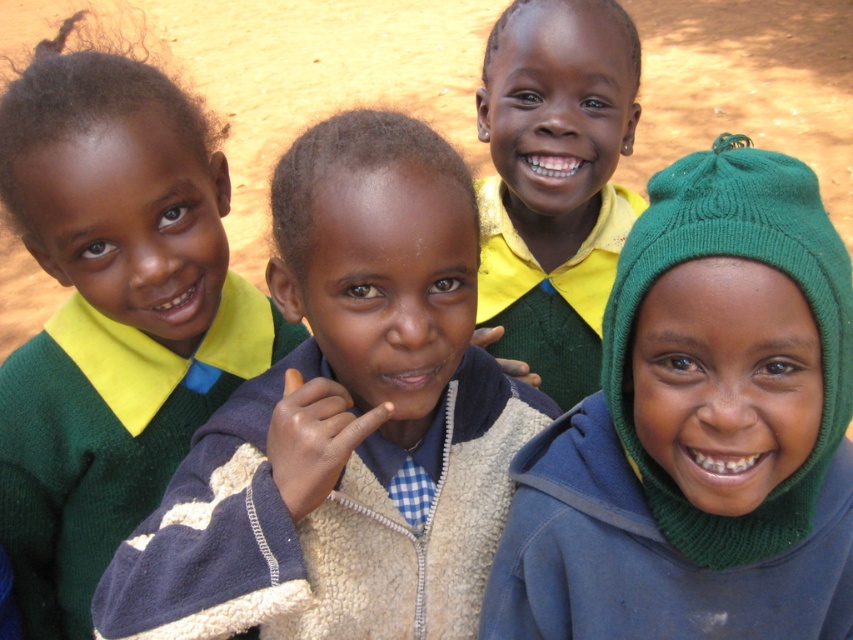
Does green knitted sweater at center appear over green knitted hat at upper right?

Yes, green knitted sweater at center is above green knitted hat at upper right.

Can you confirm if green knitted sweater at center is thinner than green knitted hat at upper right?

No, green knitted sweater at center is not thinner than green knitted hat at upper right.

Is point (386, 499) closer to viewer compared to point (804, 170)?

That is False.

Where is `green knitted sweater at center`? This screenshot has height=640, width=853. green knitted sweater at center is located at coordinates (345, 420).

Describe the element at coordinates (699, 428) in the screenshot. This screenshot has width=853, height=640. I see `green knitted hat at upper right` at that location.

Between green knitted hat at upper right and matte yellow shirt at center, which one appears on the left side from the viewer's perspective?

From the viewer's perspective, matte yellow shirt at center appears more on the left side.

Where is `green knitted hat at upper right`? green knitted hat at upper right is located at coordinates (699, 428).

I want to click on green knitted hat at upper right, so click(x=699, y=428).

Does green knitted sweater at center have a greater width compared to matte yellow shirt at center?

Indeed, green knitted sweater at center has a greater width compared to matte yellow shirt at center.

From the picture: Can you confirm if green knitted sweater at center is thinner than matte yellow shirt at center?

Result: No, green knitted sweater at center is not thinner than matte yellow shirt at center.

At what (x,y) coordinates should I click in order to perform the action: click on green knitted sweater at center. Please return your answer as a coordinate pair (x, y). The height and width of the screenshot is (640, 853). Looking at the image, I should click on (345, 420).